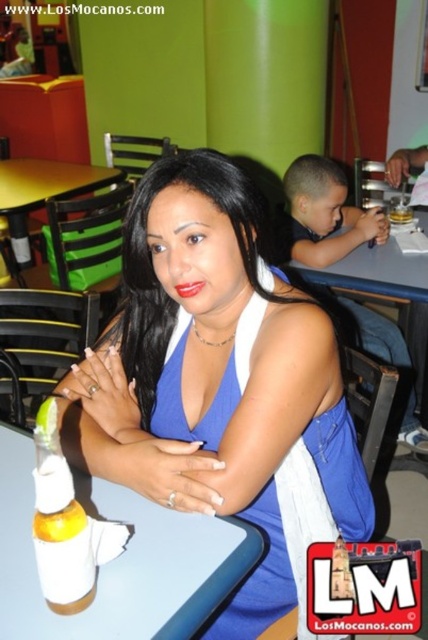
Is white plastic table at center shorter than black silky hair at center?

Correct, white plastic table at center is not as tall as black silky hair at center.

Who is positioned more to the right, white plastic table at center or black silky hair at center?

black silky hair at center

Does point (186, 529) come closer to viewer compared to point (225, 340)?

That is True.

At what (x,y) coordinates should I click in order to perform the action: click on white plastic table at center. Please return your answer as a coordinate pair (x, y). The image size is (428, 640). Looking at the image, I should click on (118, 561).

Can you confirm if blue satin dress at center is positioned to the right of green plastic table at center?

Indeed, blue satin dress at center is positioned on the right side of green plastic table at center.

Can you confirm if blue satin dress at center is positioned to the left of green plastic table at center?

Incorrect, blue satin dress at center is not on the left side of green plastic table at center.

What do you see at coordinates (219, 385) in the screenshot? The height and width of the screenshot is (640, 428). I see `blue satin dress at center` at bounding box center [219, 385].

Identify the location of blue satin dress at center. (219, 385).

Is point (55, 182) more distant than point (187, 284)?

Yes.

Is point (18, 262) closer to camera compared to point (196, 285)?

No, (18, 262) is further to viewer.

Between point (33, 161) and point (180, 285), which one is positioned behind?

Positioned behind is point (33, 161).

In order to click on green plastic table at center in this screenshot , I will do `click(42, 192)`.